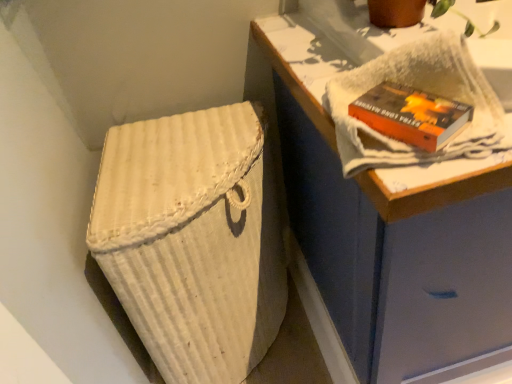
Image resolution: width=512 pixels, height=384 pixels. In order to click on vacant space situated above white woven laundry basket at lower left (from a real-world perspective) in this screenshot , I will do `click(183, 148)`.